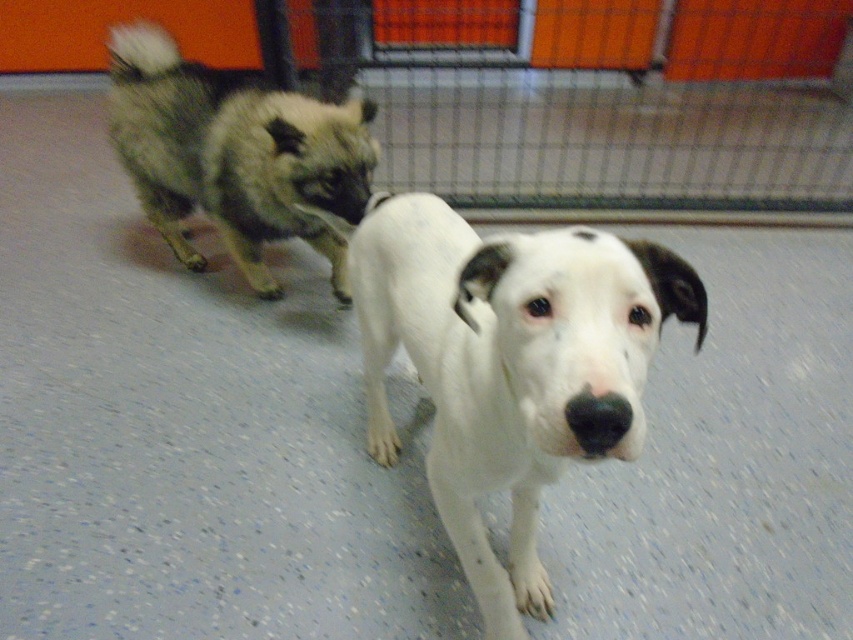
You are a photographer standing 30 inches away from the camera. You want to take a photo of the white smooth dog at center. Can you reach the dog without moving the camera?

The white smooth dog at center is 25.58 inches away from camera. Since you are standing 30 inches away from the camera, you are farther than the dog. To take the photo, you need to move closer to the camera so that you are within 25.58 inches distance from it.

You are a photographer standing in front of the two dogs. You want to take a clear photo of the fuzzy brown dog at upper left without the white smooth dog at center blocking it. Is this possible given their positions?

The white smooth dog at center is closer to the viewer than the fuzzy brown dog at upper left, so the white smooth dog at center would block the view of the fuzzy brown dog at upper left. Therefore, it is not possible to take a clear photo of the fuzzy brown dog at upper left without the white smooth dog at center blocking it.